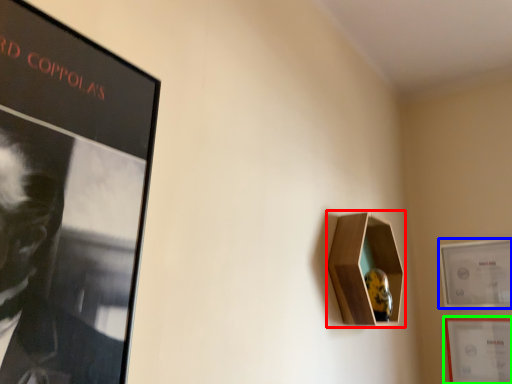
Question: Which object is the closest to the cabinet (highlighted by a red box)? Choose among these: picture frame (highlighted by a blue box) or picture frame (highlighted by a green box).

Choices:
 (A) picture frame
 (B) picture frame

Answer: (A)